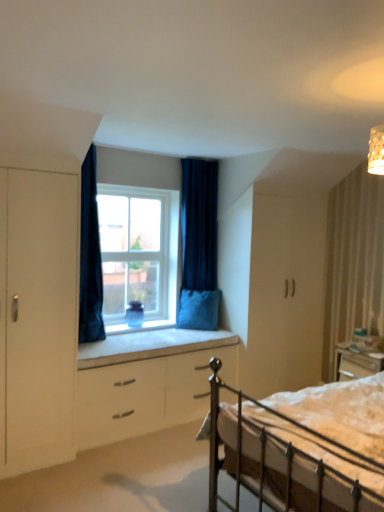
This screenshot has height=512, width=384. Find the location of `white cushioned window sill at center`. white cushioned window sill at center is located at coordinates (150, 345).

You are a GUI agent. You are given a task and a screenshot of the screen. Output one action in this format:
    pyautogui.click(x=<x>, y=<y>)
    Task: Click on the metallic silver bed at lower right
    This screenshot has height=512, width=384.
    Given the screenshot: What is the action you would take?
    pyautogui.click(x=302, y=447)

Measure the distance between point (379, 426) and camera.

Point (379, 426) is 2.26 meters away from camera.

The height and width of the screenshot is (512, 384). In order to click on dark blue velvet curtain at upper center, positioned as the 2th curtain in right-to-left order in this screenshot , I will do `click(90, 256)`.

How much space does dark blue velvet curtain at upper center, placed as the 1th curtain when sorted from front to back, occupy vertically?

It is 5.43 feet.

Identify the location of white matte cabinet at right. (284, 295).

What do you see at coordinates (284, 295) in the screenshot? The image size is (384, 512). I see `white matte cabinet at right` at bounding box center [284, 295].

What do you see at coordinates (138, 253) in the screenshot? The width and height of the screenshot is (384, 512). I see `clear glass window at center` at bounding box center [138, 253].

Locate an element on the screen. white cushioned window sill at center is located at coordinates (150, 345).

Is metallic silver bed at lower right bigger or smaller than white glossy chest of drawers at center?

Considering their sizes, metallic silver bed at lower right takes up more space than white glossy chest of drawers at center.

How much distance is there between metallic silver bed at lower right and white glossy chest of drawers at center?

metallic silver bed at lower right is 4.33 feet away from white glossy chest of drawers at center.

Is point (317, 441) more distant than point (129, 387)?

No, it is not.

Is metallic silver bed at lower right not inside white glossy chest of drawers at center?

Absolutely, metallic silver bed at lower right is external to white glossy chest of drawers at center.

From the picture: From the image's perspective, would you say velvet dark blue curtain at center, which is counted as the 2th curtain, starting from the front, is shown under velvet blue pillow at window?

Actually, velvet dark blue curtain at center, which is counted as the 2th curtain, starting from the front, appears above velvet blue pillow at window in the image.

Which is closer, (214, 172) or (189, 290)?

The point (189, 290) is closer to the camera.

Based on the photo, is there a large distance between velvet dark blue curtain at center, the first curtain viewed from the right, and velvet blue pillow at window?

No.

This screenshot has height=512, width=384. What are the coordinates of `pillow behind the white matte cabinet at right` in the screenshot? It's located at (198, 309).

Is velvet blue pillow at window not within white matte cabinet at right?

That's correct, velvet blue pillow at window is outside of white matte cabinet at right.

Based on the photo, from the image's perspective, which one is positioned lower, velvet blue pillow at window or white matte cabinet at right?

velvet blue pillow at window is shown below in the image.

Is velvet blue pillow at window not close to white matte cabinet at right?

Actually, velvet blue pillow at window and white matte cabinet at right are a little close together.

How distant is dark blue velvet curtain at upper center, placed as the 1th curtain when sorted from front to back, from velvet dark blue curtain at center, which is the first curtain from back to front?

A distance of 1.13 meters exists between dark blue velvet curtain at upper center, placed as the 1th curtain when sorted from front to back, and velvet dark blue curtain at center, which is the first curtain from back to front.

Between point (83, 279) and point (203, 174), which one is positioned behind?

The point (203, 174) is farther.

From the image's perspective, is dark blue velvet curtain at upper center, which is the first curtain from left to right, below velvet dark blue curtain at center, which is the first curtain from back to front?

Correct, dark blue velvet curtain at upper center, which is the first curtain from left to right, appears lower than velvet dark blue curtain at center, which is the first curtain from back to front, in the image.

Is dark blue velvet curtain at upper center, placed as the 1th curtain when sorted from front to back, thinner than velvet dark blue curtain at center, the second curtain from the left?

No, dark blue velvet curtain at upper center, placed as the 1th curtain when sorted from front to back, is not thinner than velvet dark blue curtain at center, the second curtain from the left.

The image size is (384, 512). Find the location of `pillow that appears on the right of white glossy chest of drawers at center`. pillow that appears on the right of white glossy chest of drawers at center is located at coordinates (198, 309).

Is velvet blue pillow at window completely or partially outside of white glossy chest of drawers at center?

That's correct, velvet blue pillow at window is outside of white glossy chest of drawers at center.

In terms of width, does velvet blue pillow at window look wider or thinner when compared to white glossy chest of drawers at center?

velvet blue pillow at window is thinner than white glossy chest of drawers at center.

Between velvet blue pillow at window and white glossy chest of drawers at center, which one has larger size?

Answer: white glossy chest of drawers at center.

Can you confirm if white matte cabinet at right is shorter than clear glass window at center?

In fact, white matte cabinet at right may be taller than clear glass window at center.

At what (x,y) coordinates should I click in order to perform the action: click on cabinetry on the right of clear glass window at center. Please return your answer as a coordinate pair (x, y). The width and height of the screenshot is (384, 512). Looking at the image, I should click on pyautogui.click(x=284, y=295).

Which object is closer to the camera, white matte cabinet at right or clear glass window at center?

white matte cabinet at right is closer to the camera.

Choose the correct answer: Is white matte cabinet at right inside clear glass window at center or outside it?

white matte cabinet at right is outside clear glass window at center.

Which is in front, point (17, 291) or point (183, 167)?

Point (17, 291)

From the image's perspective, relative to velvet dark blue curtain at center, the second curtain from the left, is white matte cabinet at left above or below?

Based on their image positions, white matte cabinet at left is located beneath velvet dark blue curtain at center, the second curtain from the left.

There is a white matte cabinet at left. At what (x,y) coordinates should I click in order to perform the action: click on the 2nd curtain above it (from the image's perspective). Please return your answer as a coordinate pair (x, y). The width and height of the screenshot is (384, 512). Looking at the image, I should click on point(199,224).

Identify the location of chest of drawers that appears on the left of metallic silver bed at lower right. Image resolution: width=384 pixels, height=512 pixels. (146, 395).

At what (x,y) coordinates should I click in order to perform the action: click on pillow on the right of the velvet dark blue curtain at center, which is counted as the 2th curtain, starting from the front. Please return your answer as a coordinate pair (x, y). The height and width of the screenshot is (512, 384). Looking at the image, I should click on (198, 309).

Which object lies nearer to the anchor point white matte cabinet at right, clear glass window at center or velvet dark blue curtain at center, which is the first curtain from back to front?

Among the two, velvet dark blue curtain at center, which is the first curtain from back to front, is located nearer to white matte cabinet at right.

Estimate the real-world distances between objects in this image. Which object is further from white cushioned window sill at center, white matte cabinet at right or metallic silver bed at lower right?

Based on the image, metallic silver bed at lower right appears to be further to white cushioned window sill at center.

Considering their positions, is velvet dark blue curtain at center, the first curtain viewed from the right, positioned further to white glossy chest of drawers at center than velvet blue pillow at window?

The object further to white glossy chest of drawers at center is velvet dark blue curtain at center, the first curtain viewed from the right.

From the image, which object appears to be farther from clear glass window at center, velvet blue pillow at window or metallic silver bed at lower right?

metallic silver bed at lower right is positioned further to the anchor clear glass window at center.

Looking at the image, which one is located further to dark blue velvet curtain at upper center, placed as the 1th curtain when sorted from front to back, white matte cabinet at right or white matte cabinet at left?

white matte cabinet at right is positioned further to the anchor dark blue velvet curtain at upper center, placed as the 1th curtain when sorted from front to back.

Looking at the image, which one is located further to white matte cabinet at left, metallic silver bed at lower right or velvet dark blue curtain at center, the first curtain viewed from the right?

The object further to white matte cabinet at left is velvet dark blue curtain at center, the first curtain viewed from the right.

Which object lies nearer to the anchor point white matte cabinet at left, white glossy chest of drawers at center or velvet blue pillow at window?

Based on the image, white glossy chest of drawers at center appears to be nearer to white matte cabinet at left.

Based on the photo, looking at the image, which one is located closer to white glossy chest of drawers at center, clear glass window at center or dark blue velvet curtain at upper center, which is the first curtain from left to right?

Among the two, dark blue velvet curtain at upper center, which is the first curtain from left to right, is located nearer to white glossy chest of drawers at center.

Where is `curtain between white matte cabinet at left and velvet dark blue curtain at center, the second curtain from the left, from front to back`? curtain between white matte cabinet at left and velvet dark blue curtain at center, the second curtain from the left, from front to back is located at coordinates (90, 256).

This screenshot has width=384, height=512. What are the coordinates of `the chest of drawers located between white matte cabinet at left and clear glass window at center in the depth direction` in the screenshot? It's located at (146, 395).

Locate an element on the screen. The width and height of the screenshot is (384, 512). window positioned between white cushioned window sill at center and velvet blue pillow at window from near to far is located at coordinates (138, 253).

Find the location of a particular element. The image size is (384, 512). curtain between dark blue velvet curtain at upper center, placed as the 1th curtain when sorted from front to back, and white matte cabinet at right is located at coordinates click(x=199, y=224).